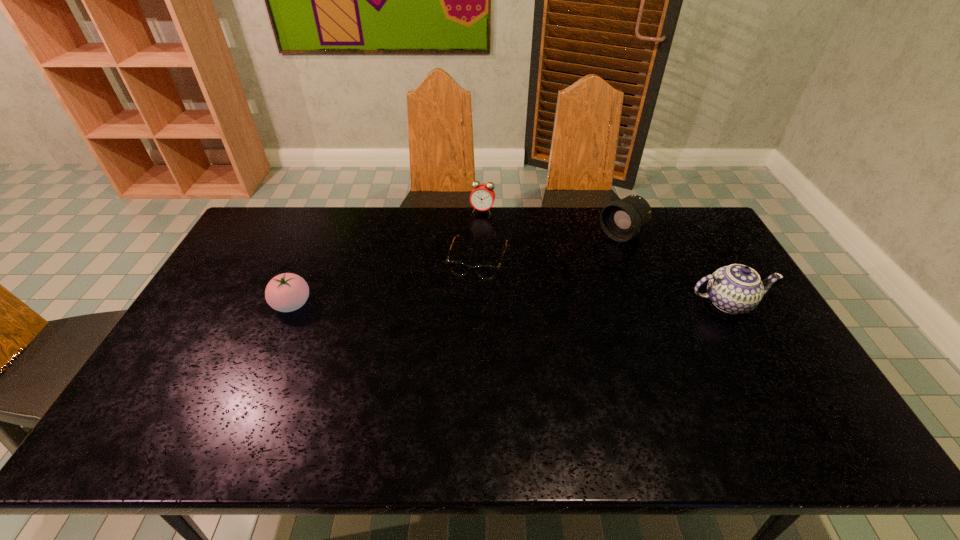
Find the location of a particular element. free region that satisfies the following two spatial constraints: 1. on the back side of the shortest object; 2. on the right side of the fourth object from left to right is located at coordinates (478, 234).